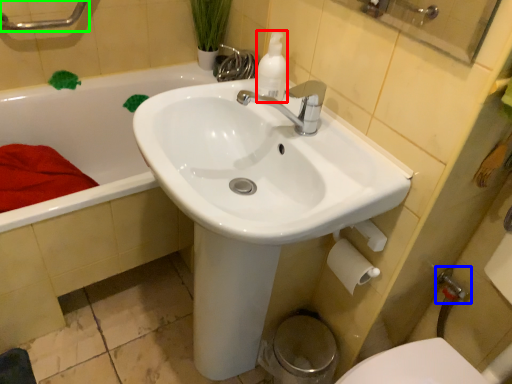
Question: Estimate the real-world distances between objects in this image. Which object is closer to cleaning product (highlighted by a red box), plumbing fixture (highlighted by a blue box) or shower (highlighted by a green box)?

Choices:
 (A) plumbing fixture
 (B) shower

Answer: (A)